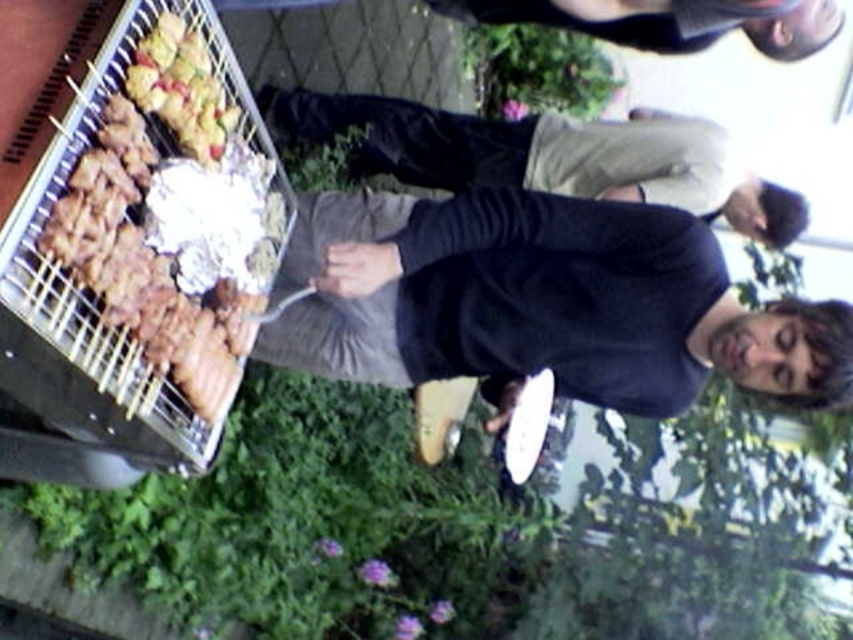
Question: Which object is closer to the camera taking this photo?

Choices:
 (A) metallic grill at left
 (B) golden brown skewers at upper left
 (C) dark gray pants at center
 (D) dark gray sweater at upper center

Answer: (A)

Question: Can you confirm if dark gray sweater at upper center is thinner than golden brown skewers at upper left?

Choices:
 (A) yes
 (B) no

Answer: (B)

Question: Estimate the real-world distances between objects in this image. Which object is farther from the golden brown skewers at upper left?

Choices:
 (A) dark gray sweater at center
 (B) dark gray pants at center

Answer: (B)

Question: Is metallic grill at left bigger than dark gray sweater at upper center?

Choices:
 (A) yes
 (B) no

Answer: (A)

Question: Considering the relative positions of dark gray pants at center and golden brown skewers at upper left in the image provided, where is dark gray pants at center located with respect to golden brown skewers at upper left?

Choices:
 (A) above
 (B) below

Answer: (A)

Question: Which point is closer to the camera taking this photo?

Choices:
 (A) (531, 12)
 (B) (413, 129)
 (C) (596, 352)
 (D) (38, 196)

Answer: (D)